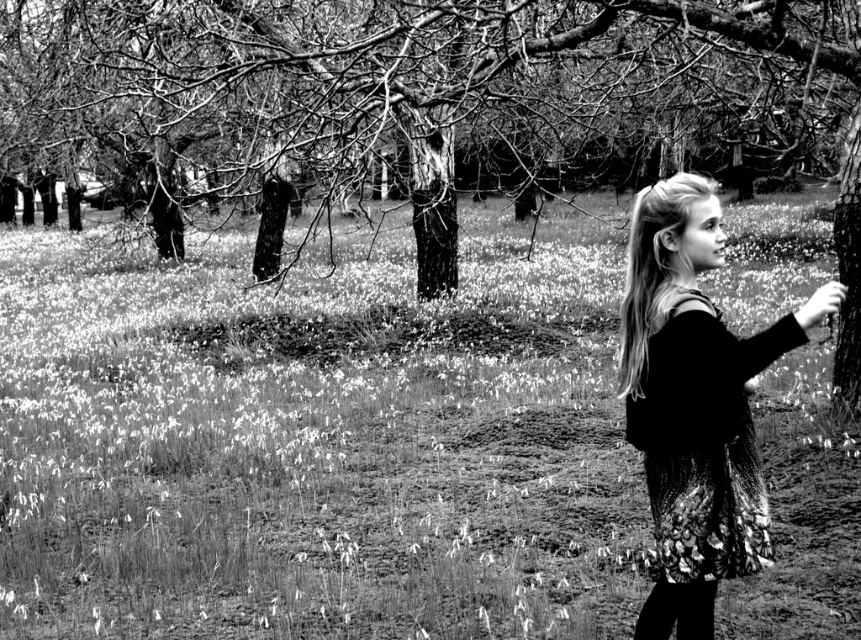
Question: Does rough bark tree at upper center lie behind knitted sweater at right?

Choices:
 (A) yes
 (B) no

Answer: (A)

Question: Which point is closer to the camera?

Choices:
 (A) (739, 422)
 (B) (202, 38)

Answer: (A)

Question: Can you confirm if white grass at center is positioned to the right of rough bark tree at upper center?

Choices:
 (A) no
 (B) yes

Answer: (B)

Question: Where is white grass at center located in relation to knitted sweater at right in the image?

Choices:
 (A) right
 (B) left

Answer: (B)

Question: Among these points, which one is nearest to the camera?

Choices:
 (A) (686, 592)
 (B) (144, 413)
 (C) (239, 70)

Answer: (A)

Question: Which object is farther from the camera taking this photo?

Choices:
 (A) white grass at center
 (B) rough bark tree at upper center

Answer: (B)